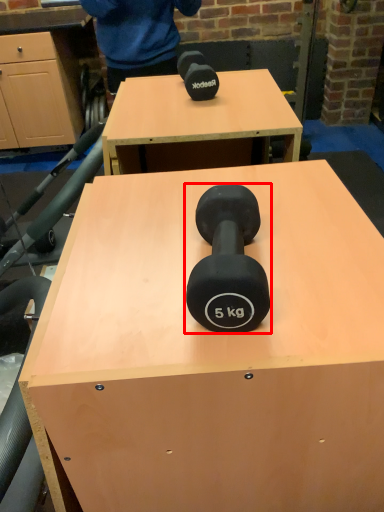
Question: Observing the image, what is the correct spatial positioning of dumbbell (annotated by the red box) in reference to table?

Choices:
 (A) right
 (B) left

Answer: (A)